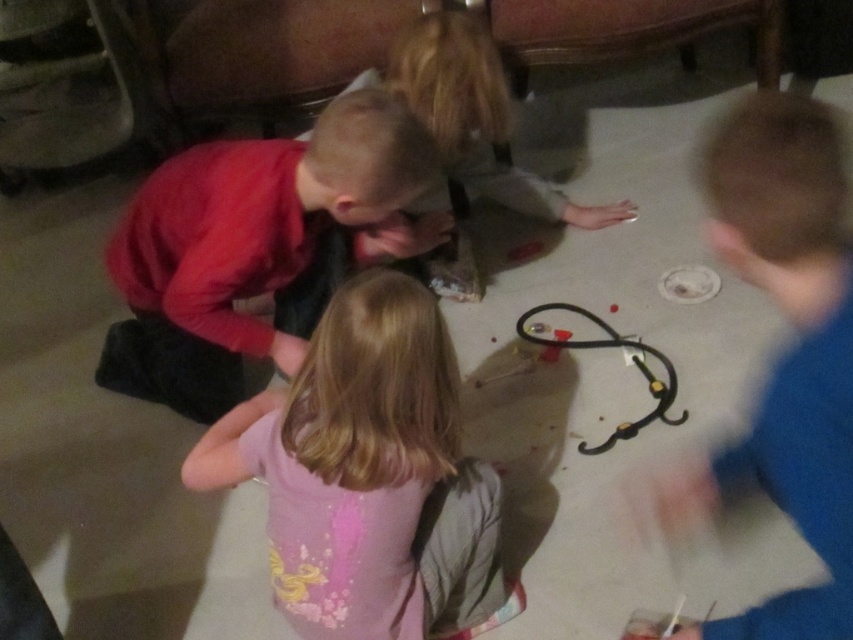
Who is positioned more to the right, red matte shirt at center or black rubber train at center?

From the viewer's perspective, black rubber train at center appears more on the right side.

What do you see at coordinates (251, 244) in the screenshot?
I see `red matte shirt at center` at bounding box center [251, 244].

Is point (392, 188) positioned before point (659, 403)?

Yes.

You are a GUI agent. You are given a task and a screenshot of the screen. Output one action in this format:
    pyautogui.click(x=<x>, y=<y>)
    Task: Click on the red matte shirt at center
    The height and width of the screenshot is (640, 853).
    Given the screenshot: What is the action you would take?
    pyautogui.click(x=251, y=244)

The width and height of the screenshot is (853, 640). Describe the element at coordinates (366, 474) in the screenshot. I see `pink fabric shirt at center` at that location.

Does pink fabric shirt at center appear under red matte shirt at center?

Yes, pink fabric shirt at center is below red matte shirt at center.

The height and width of the screenshot is (640, 853). Find the location of `pink fabric shirt at center`. pink fabric shirt at center is located at coordinates (366, 474).

Is pink fabric shirt at center bigger than black rubber train at center?

Indeed, pink fabric shirt at center has a larger size compared to black rubber train at center.

Which is more to the right, pink fabric shirt at center or black rubber train at center?

Positioned to the right is black rubber train at center.

I want to click on pink fabric shirt at center, so click(x=366, y=474).